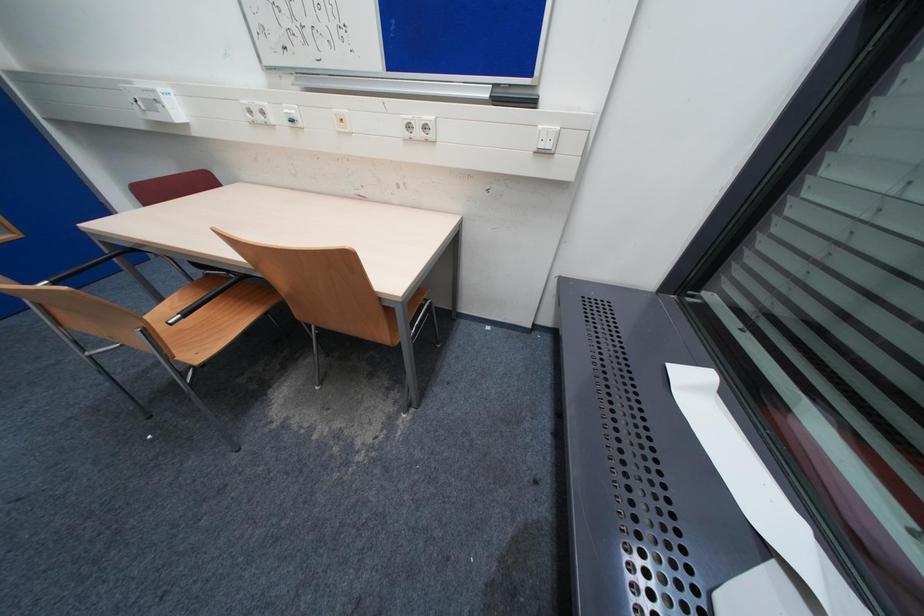
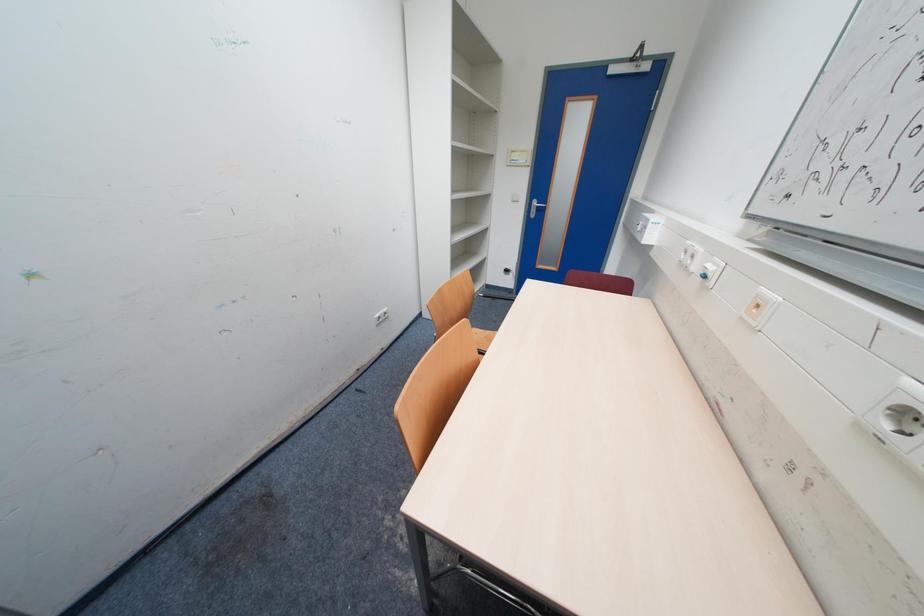
The images are taken continuously from a first-person perspective. In which direction is your viewpoint rotating?

The rotation direction of the camera is left-down.